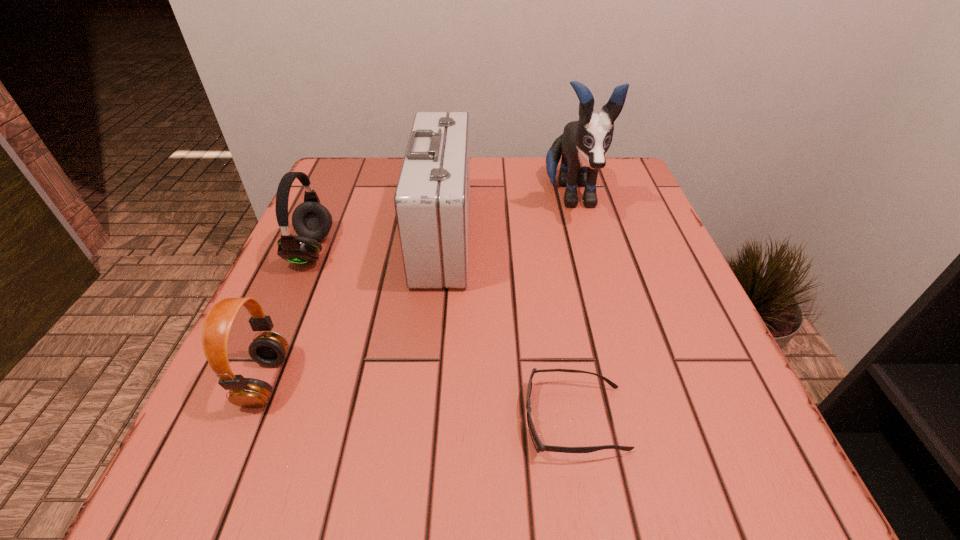
This screenshot has height=540, width=960. In the image, there is a desktop. Identify the location of vacant space at the left edge. (352, 268).

In the image, there is a desktop. Where is `vacant space at the right edge`? The image size is (960, 540). vacant space at the right edge is located at coordinates (595, 234).

I want to click on vacant space at the far left corner, so click(362, 204).

This screenshot has width=960, height=540. I want to click on vacant space at the near left corner of the desktop, so point(276,475).

In the image, there is a desktop. Where is `vacant space at the far right corner`? vacant space at the far right corner is located at coordinates (601, 171).

Locate an element on the screen. This screenshot has width=960, height=540. vacant space at the near right corner is located at coordinates (742, 474).

The height and width of the screenshot is (540, 960). In order to click on empty space between the farther headset and the nearer headset in this screenshot , I will do `click(289, 315)`.

Identify the location of free space that is in between the nearer headset and the fourth shortest object. The image size is (960, 540). (354, 308).

You are a GUI agent. You are given a task and a screenshot of the screen. Output one action in this format:
    pyautogui.click(x=<x>, y=<y>)
    Task: Click on the empty space that is in between the farther headset and the nearer headset
    
    Given the screenshot: What is the action you would take?
    pyautogui.click(x=289, y=315)

The width and height of the screenshot is (960, 540). Find the location of `unoccupied area between the shortest object and the first-aid kit`. unoccupied area between the shortest object and the first-aid kit is located at coordinates (509, 327).